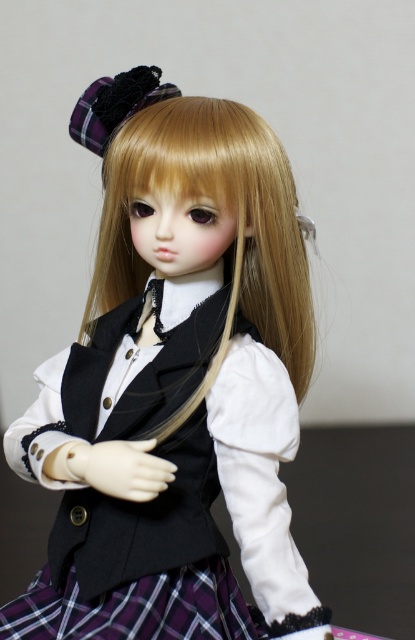
You are a stylist preparing to photograph the doll. You need to ensure that the doll is positioned so that the blonde silky hair at center and plaid fabric at center are both visible. Given that the camera is at eye level, which object should you adjust to be lower to ensure both are in frame?

The plaid fabric at center should be lowered since the blonde silky hair at center is taller, making it more likely to block the view of the plaid fabric at center if not adjusted.

You are a fashion designer examining the doll. You need to determine which item on the doll is bigger in size between the matte black vest at center and the blonde silky hair at center. Which one is larger?

The matte black vest at center is larger in size than the blonde silky hair at center.

You are a fashion designer examining a doll dressed in a school uniform. You need to place a decorative pin exactly at point [175,388]. Which part of the doll should you place the pin on?

The matte black vest at center is located at point [175,388], so you should place the pin on the matte black vest at center.